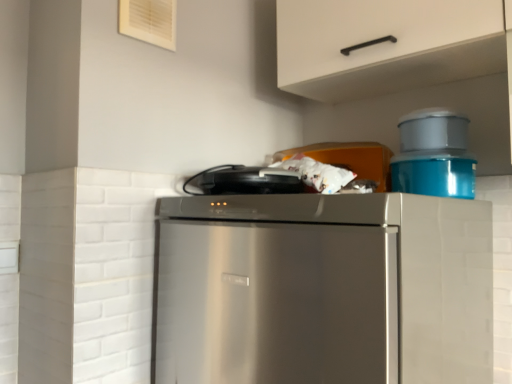
Question: From the image's perspective, would you say matte plastic container at upper right, which appears as the second appliance when viewed from the right, is shown under stainless steel refrigerator at center?

Choices:
 (A) no
 (B) yes

Answer: (A)

Question: Is matte plastic container at upper right, which appears as the second appliance when viewed from the right, closer to the viewer compared to stainless steel refrigerator at center?

Choices:
 (A) yes
 (B) no

Answer: (B)

Question: Considering the relative sizes of matte plastic container at upper right, placed as the 2th appliance when sorted from left to right, and stainless steel refrigerator at center in the image provided, is matte plastic container at upper right, placed as the 2th appliance when sorted from left to right, taller than stainless steel refrigerator at center?

Choices:
 (A) yes
 (B) no

Answer: (B)

Question: From the image's perspective, is matte plastic container at upper right, which appears as the second appliance when viewed from the right, above stainless steel refrigerator at center?

Choices:
 (A) yes
 (B) no

Answer: (A)

Question: From a real-world perspective, is matte plastic container at upper right, placed as the 2th appliance when sorted from left to right, physically below stainless steel refrigerator at center?

Choices:
 (A) no
 (B) yes

Answer: (A)

Question: Is point (433, 173) closer or farther from the camera than point (252, 185)?

Choices:
 (A) farther
 (B) closer

Answer: (A)

Question: Is blue plastic container at upper right, the first appliance from the right, situated inside black matte toaster at upper center, the 3th appliance when ordered from right to left, or outside?

Choices:
 (A) inside
 (B) outside

Answer: (B)

Question: Looking at the image, does blue plastic container at upper right, the third appliance from the left, seem bigger or smaller compared to black matte toaster at upper center, acting as the first appliance starting from the left?

Choices:
 (A) small
 (B) big

Answer: (B)

Question: From a real-world perspective, is blue plastic container at upper right, the third appliance from the left, above or below black matte toaster at upper center, the 3th appliance when ordered from right to left?

Choices:
 (A) above
 (B) below

Answer: (A)

Question: From a real-world perspective, is matte plastic container at upper right, placed as the 2th appliance when sorted from left to right, positioned above or below stainless steel refrigerator at center?

Choices:
 (A) above
 (B) below

Answer: (A)

Question: Which is correct: matte plastic container at upper right, which appears as the second appliance when viewed from the right, is inside stainless steel refrigerator at center, or outside of it?

Choices:
 (A) inside
 (B) outside

Answer: (B)

Question: Considering the positions of matte plastic container at upper right, which appears as the second appliance when viewed from the right, and stainless steel refrigerator at center in the image, is matte plastic container at upper right, which appears as the second appliance when viewed from the right, taller or shorter than stainless steel refrigerator at center?

Choices:
 (A) short
 (B) tall

Answer: (A)

Question: Considering their positions, is matte plastic container at upper right, placed as the 2th appliance when sorted from left to right, located in front of or behind stainless steel refrigerator at center?

Choices:
 (A) behind
 (B) front

Answer: (A)

Question: From the image's perspective, is stainless steel refrigerator at center located above or below white matte cabinet handle at upper center?

Choices:
 (A) below
 (B) above

Answer: (A)

Question: Is stainless steel refrigerator at center taller or shorter than white matte cabinet handle at upper center?

Choices:
 (A) short
 (B) tall

Answer: (B)